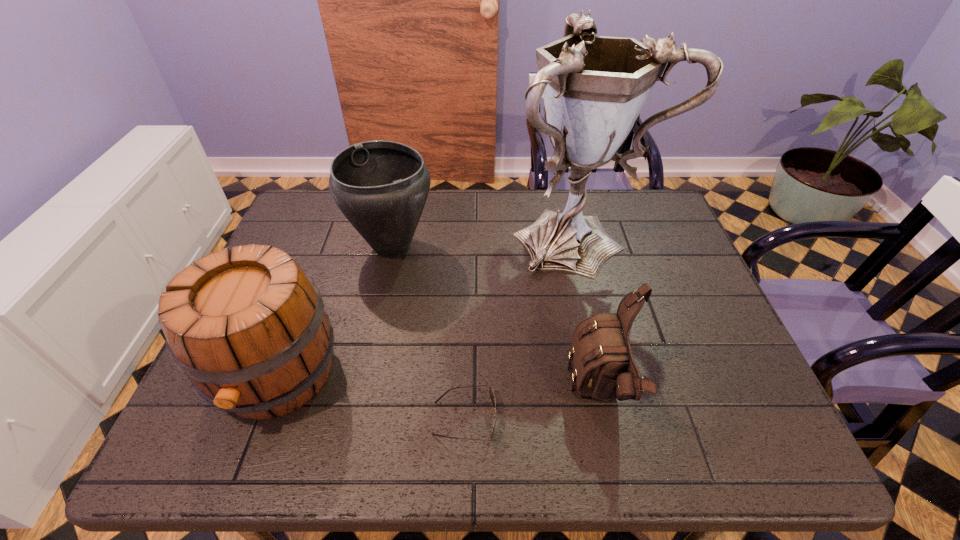
This screenshot has width=960, height=540. Identify the location of vacant region between the cider and the sunglasses. (371, 396).

Identify the location of blank region between the urn and the shoulder bag. The width and height of the screenshot is (960, 540). (496, 320).

Locate an element on the screen. This screenshot has width=960, height=540. unoccupied position between the urn and the cider is located at coordinates [x=334, y=310].

Locate an element on the screen. The height and width of the screenshot is (540, 960). free point between the shoulder bag and the third object from left to right is located at coordinates (533, 407).

Find the location of a particular element. free space between the sunglasses and the trophy cup is located at coordinates (521, 327).

Locate an element on the screen. This screenshot has height=540, width=960. object that stands as the fourth closest to the shoulder bag is located at coordinates (248, 327).

Identify the location of object that is the closest to the shortest object. (604, 368).